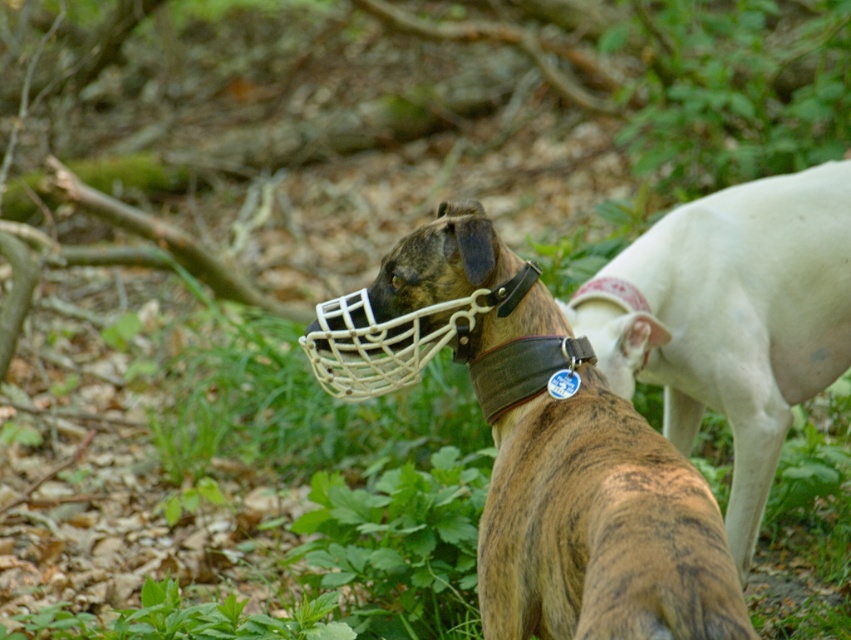
Does brown brindle dog at center have a lesser height compared to brown canvas collar at center?

In fact, brown brindle dog at center may be taller than brown canvas collar at center.

Is brown brindle dog at center smaller than brown canvas collar at center?

Incorrect, brown brindle dog at center is not smaller in size than brown canvas collar at center.

Is point (540, 323) closer to camera compared to point (478, 362)?

That is True.

At what (x,y) coordinates should I click in order to perform the action: click on brown brindle dog at center. Please return your answer as a coordinate pair (x, y). Looking at the image, I should click on (541, 445).

Is point (629, 308) behind point (527, 336)?

Yes.

Consider the image. Between white smooth dog at right and brown canvas collar at center, which one is positioned higher?

white smooth dog at right is above.

Measure the distance between white smooth dog at right and camera.

white smooth dog at right is 2.74 meters from camera.

The width and height of the screenshot is (851, 640). Find the location of `white smooth dog at right`. white smooth dog at right is located at coordinates (730, 317).

Can you confirm if brown brindle dog at center is thinner than white smooth dog at right?

Correct, brown brindle dog at center's width is less than white smooth dog at right's.

Can you confirm if brown brindle dog at center is positioned below white smooth dog at right?

Yes.

Which is behind, point (595, 497) or point (775, 230)?

Point (775, 230)

Identify the location of brown brindle dog at center. (541, 445).